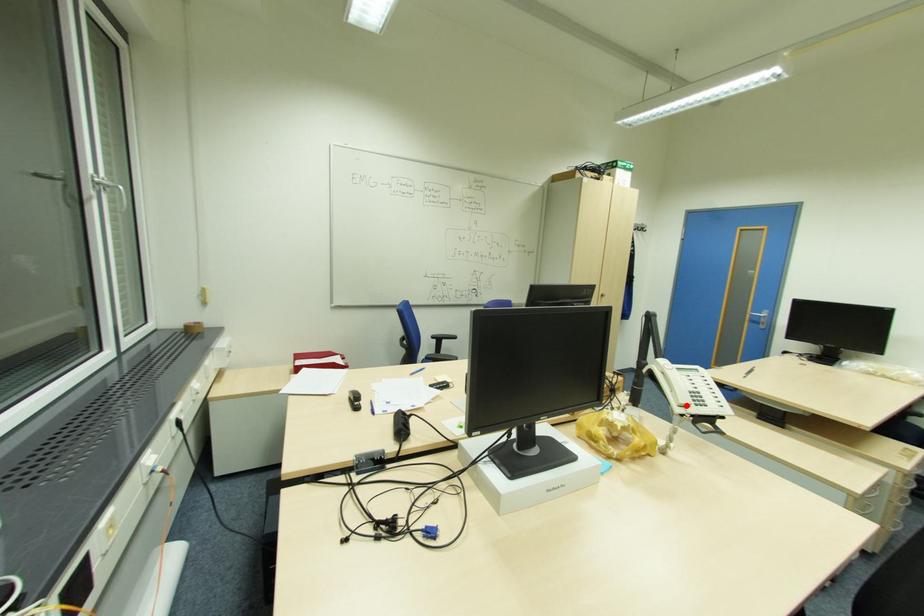
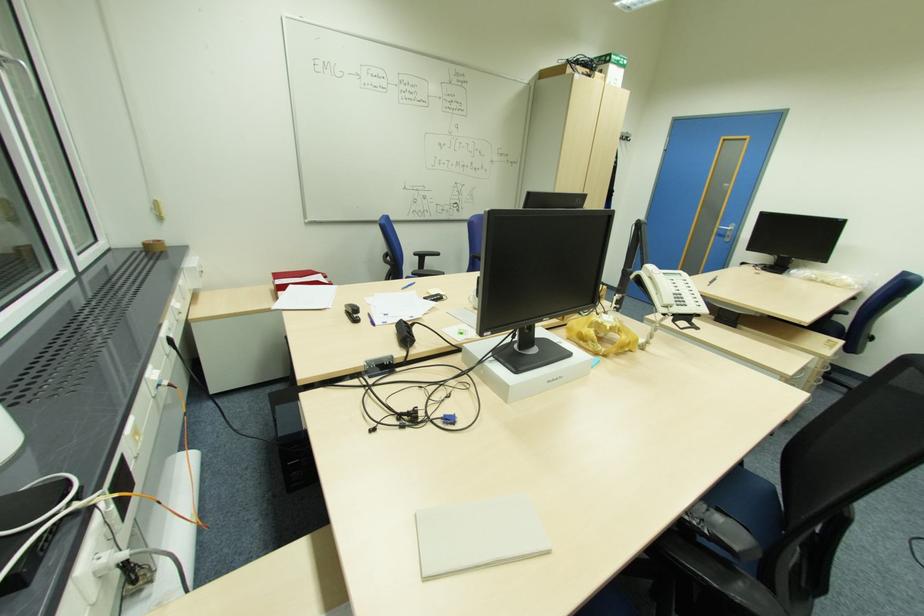
Find the pixel in the second image that matches the highlighted location in the first image.

(670, 306)